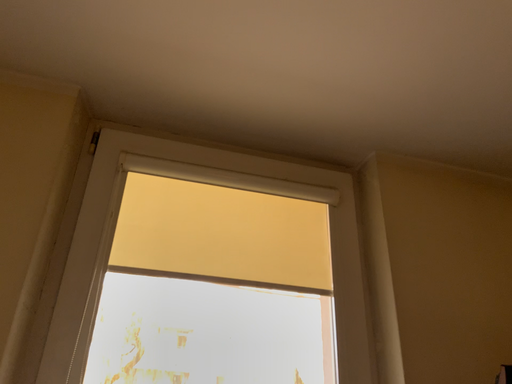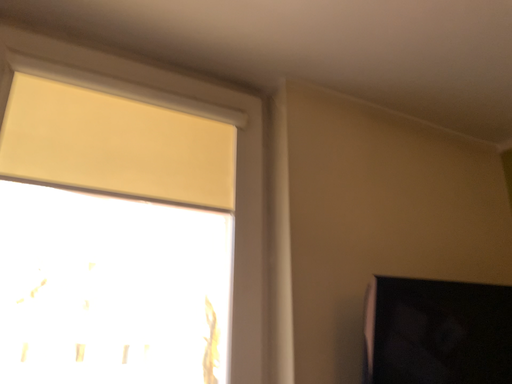
Question: How did the camera likely rotate when shooting the video?

Choices:
 (A) rotated downward
 (B) rotated upward

Answer: (A)